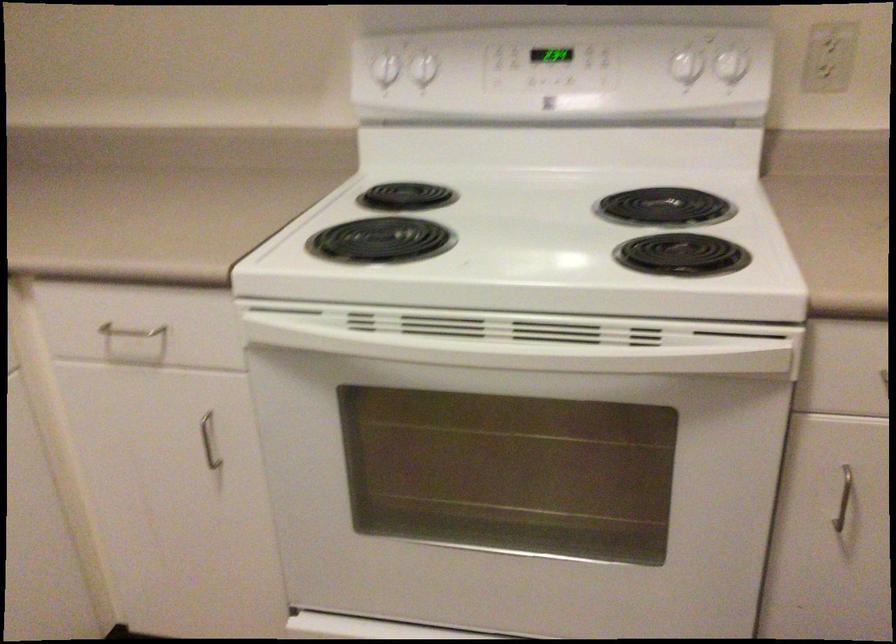
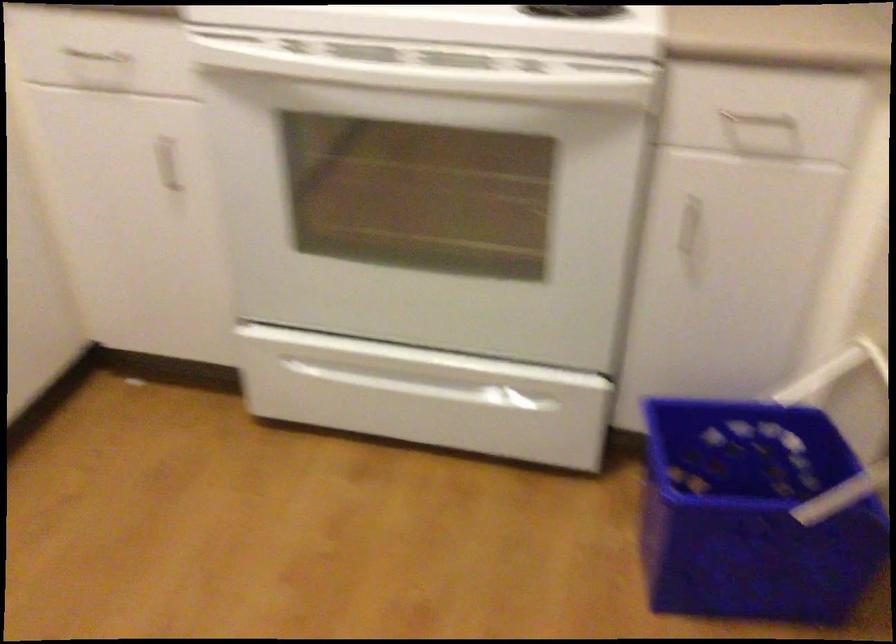
Question: The first image is from the beginning of the video and the second image is from the end. How did the camera likely rotate when shooting the video?

Choices:
 (A) Left
 (B) Right
 (C) Up
 (D) Down

Answer: (D)